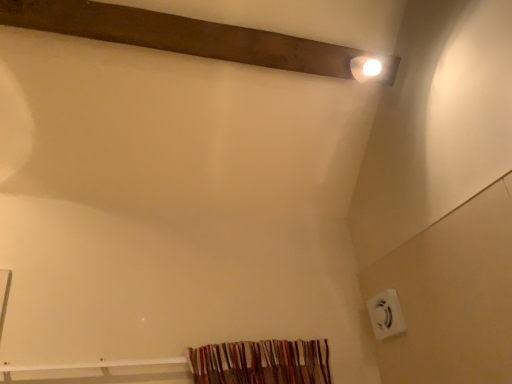
What do you see at coordinates (386, 314) in the screenshot? I see `white plastic electric outlet at lower right` at bounding box center [386, 314].

Locate an element on the screen. white plastic electric outlet at lower right is located at coordinates (386, 314).

Where is `white plastic electric outlet at lower right`? white plastic electric outlet at lower right is located at coordinates (386, 314).